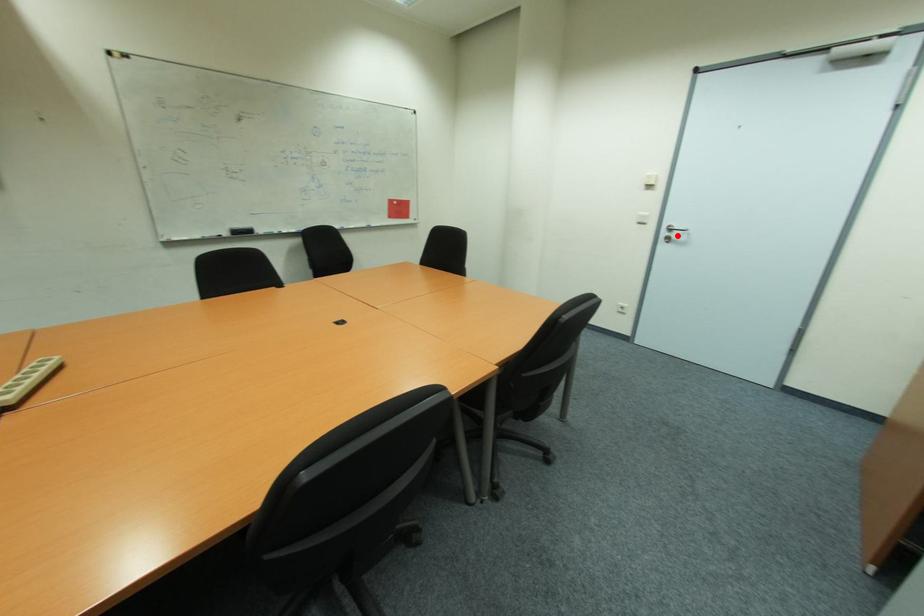
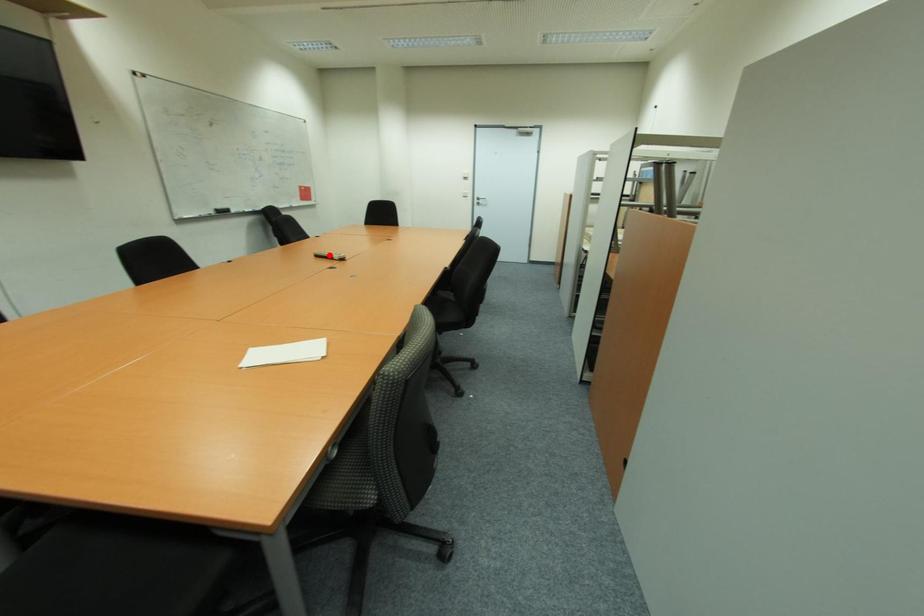
Based on the photo, I am providing you with two images of the same scene from different viewpoints. A red point is marked on the first image and another point is marked on the second image. Are the points marked in image1 and image2 representing the same 3D position?

No